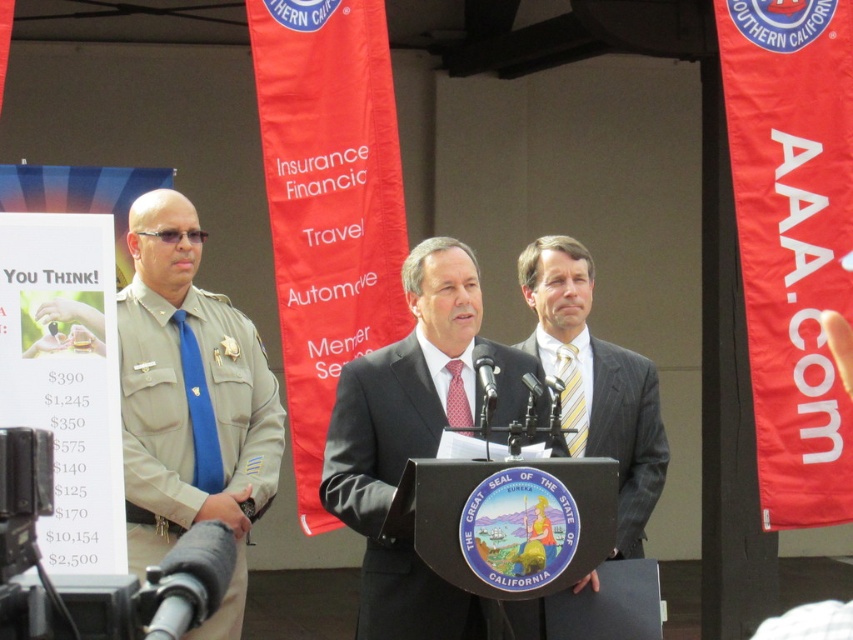
Looking at this image, you are attending a formal event and need to locate the person wearing a matte black suit at center. Using the coordinate system where the bottom left corner is the origin, can you determine if this person is positioned closer to the top or bottom of the image?

The 2D location of the matte black suit at center is at point (415,444). Since the y coordinate is 0.487, which is closer to 0.5, the midpoint between top and bottom, the person is positioned approximately in the middle vertically, neither closer to the top nor the bottom of the image.